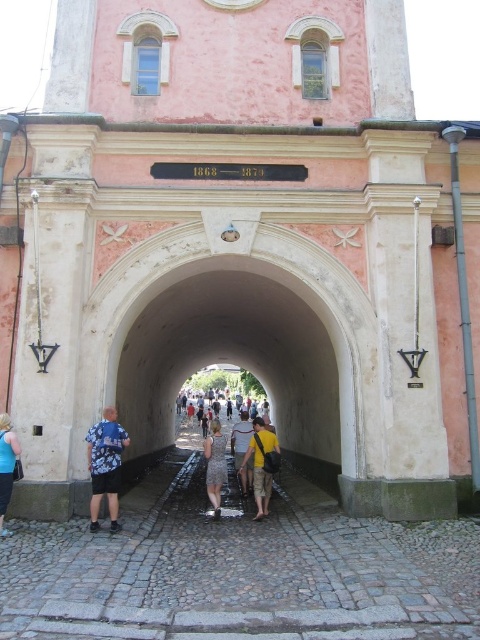
Consider the image. Is yellow fabric shirt at center smaller than patterned dress at center?

Indeed, yellow fabric shirt at center has a smaller size compared to patterned dress at center.

Can you confirm if yellow fabric shirt at center is thinner than patterned dress at center?

Yes, yellow fabric shirt at center is thinner than patterned dress at center.

Which is behind, point (276, 435) or point (217, 445)?

The point (276, 435) is behind.

In order to click on yellow fabric shirt at center in this screenshot , I will do (262, 464).

Where is `patterned dress at center`? patterned dress at center is located at coordinates (215, 465).

The height and width of the screenshot is (640, 480). I want to click on patterned dress at center, so click(215, 465).

Does white stone tunnel at center appear under dark gray cotton shirt at center?

No.

Based on the photo, does white stone tunnel at center appear on the right side of dark gray cotton shirt at center?

Indeed, white stone tunnel at center is positioned on the right side of dark gray cotton shirt at center.

Does point (162, 376) come farther from viewer compared to point (183, 397)?

That is False.

In order to click on white stone tunnel at center in this screenshot , I will do `click(248, 368)`.